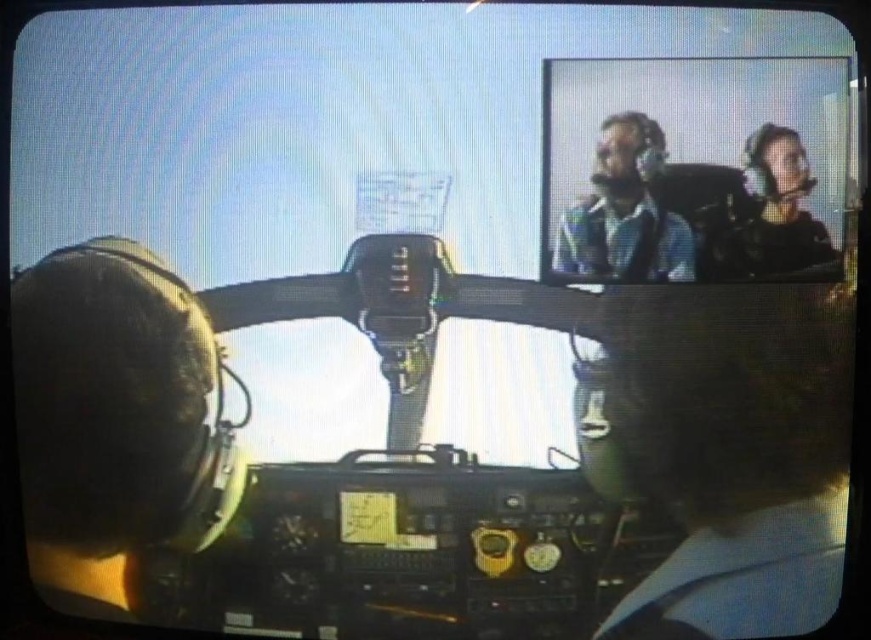
Which is behind, point (647, 461) or point (591, 180)?

The point (647, 461) is behind.

Does point (802, 321) come farther from viewer compared to point (623, 212)?

Yes, it is.

At what (x,y) coordinates should I click in order to perform the action: click on dark brown hair at center. Please return your answer as a coordinate pair (x, y). Looking at the image, I should click on (728, 445).

What are the coordinates of `dark brown hair at center` in the screenshot? It's located at (728, 445).

Who is positioned more to the right, matte black helmet at left or matte black helmet at upper right?

matte black helmet at upper right

Describe the element at coordinates (116, 408) in the screenshot. I see `matte black helmet at left` at that location.

Where is `matte black helmet at left`? The image size is (871, 640). matte black helmet at left is located at coordinates (116, 408).

From the picture: Is dark brown hair at center taller than matte black helmet at left?

No.

You are a GUI agent. You are given a task and a screenshot of the screen. Output one action in this format:
    pyautogui.click(x=<x>, y=<y>)
    Task: Click on the dark brown hair at center
    This screenshot has height=640, width=871.
    Given the screenshot: What is the action you would take?
    pyautogui.click(x=728, y=445)